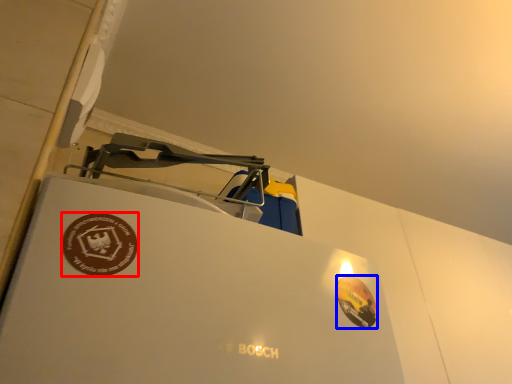
Question: Which object appears farthest to the camera in this image, logo (highlighted by a red box) or logo (highlighted by a blue box)?

Choices:
 (A) logo
 (B) logo

Answer: (B)